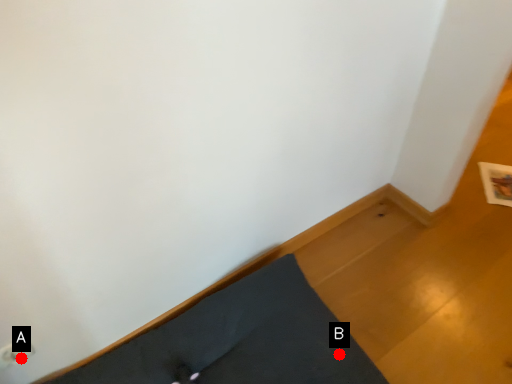
Question: Two points are circled on the image, labeled by A and B beside each circle. Which point is closer to the camera taking this photo?

Choices:
 (A) A is closer
 (B) B is closer

Answer: (A)